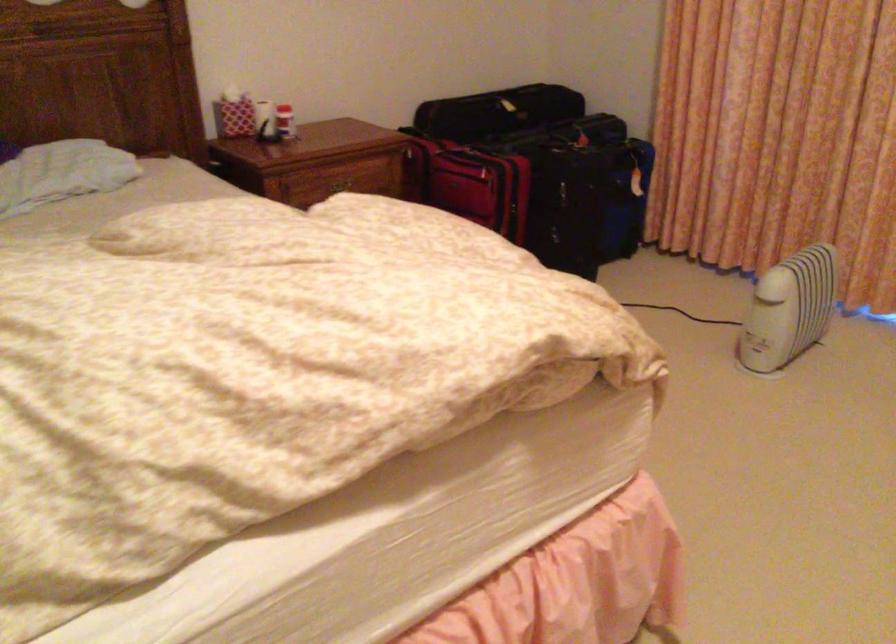
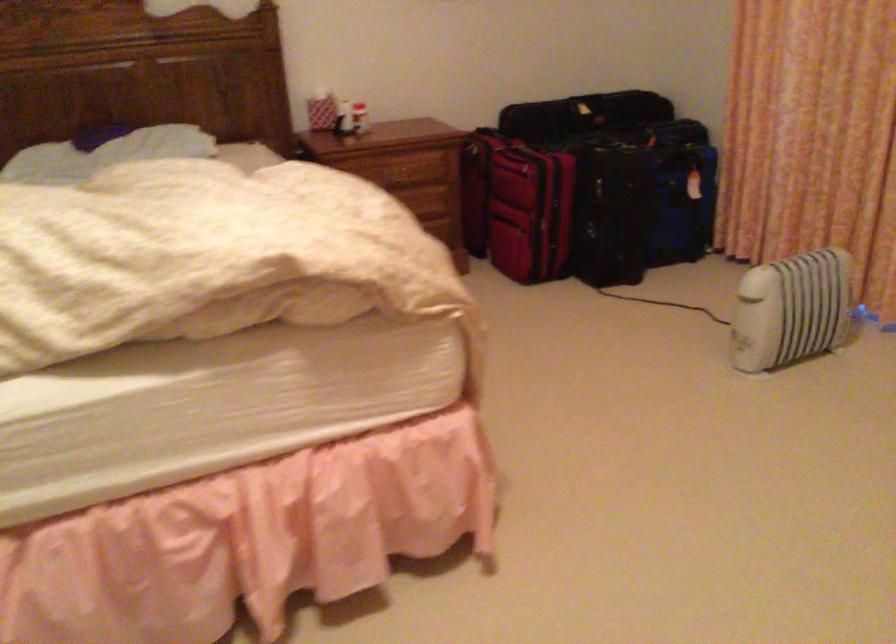
Question: In a continuous first-person perspective shot, in which direction is the camera moving?

Choices:
 (A) Left
 (B) Right
 (C) Forward
 (D) Backward

Answer: (B)